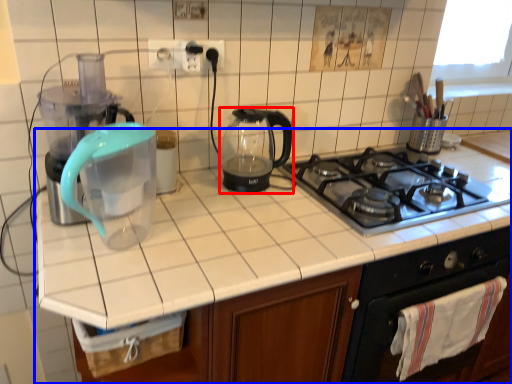
Question: Which of the following is the farthest to the observer, kitchen appliance (highlighted by a red box) or countertop (highlighted by a blue box)?

Choices:
 (A) kitchen appliance
 (B) countertop

Answer: (A)